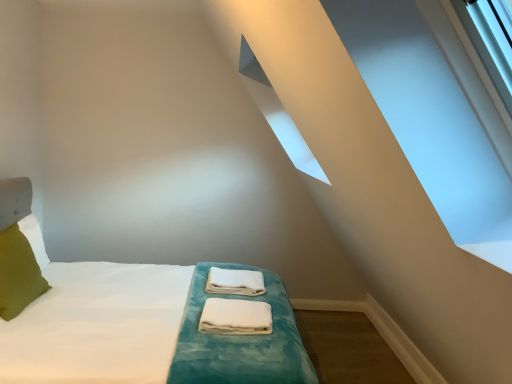
Question: Is green fabric pillow at left wider than white cotton towels at center, marked as the first material in a front-to-back arrangement?

Choices:
 (A) yes
 (B) no

Answer: (B)

Question: Considering the relative sizes of green fabric pillow at left and white cotton towels at center, marked as the first material in a front-to-back arrangement, in the image provided, is green fabric pillow at left bigger than white cotton towels at center, marked as the first material in a front-to-back arrangement,?

Choices:
 (A) no
 (B) yes

Answer: (B)

Question: Is green fabric pillow at left at the left side of white cotton towels at center, marked as the first material in a front-to-back arrangement?

Choices:
 (A) no
 (B) yes

Answer: (B)

Question: Is green fabric pillow at left far from white cotton towels at center, marked as the first material in a front-to-back arrangement?

Choices:
 (A) yes
 (B) no

Answer: (A)

Question: Would you say white cotton towels at center, marked as the first material in a front-to-back arrangement, is part of green fabric pillow at left's contents?

Choices:
 (A) yes
 (B) no

Answer: (B)

Question: Is white cotton towels at center, marked as the first material in a front-to-back arrangement, in front of or behind white soft bed at center in the image?

Choices:
 (A) front
 (B) behind

Answer: (B)

Question: Is white cotton towels at center, marked as the first material in a front-to-back arrangement, taller or shorter than white soft bed at center?

Choices:
 (A) short
 (B) tall

Answer: (A)

Question: In the image, is white cotton towels at center, which is the second material from back to front, on the left side or the right side of white soft bed at center?

Choices:
 (A) left
 (B) right

Answer: (B)

Question: From the image's perspective, is white cotton towels at center, marked as the first material in a front-to-back arrangement, positioned above or below white soft bed at center?

Choices:
 (A) above
 (B) below

Answer: (B)

Question: From their relative heights in the image, would you say white fabric towels at center, marked as the 2th material in a front-to-back arrangement, is taller or shorter than white cotton towels at center, marked as the first material in a front-to-back arrangement?

Choices:
 (A) tall
 (B) short

Answer: (A)

Question: Is white fabric towels at center, which ranks as the 1th material in back-to-front order, to the left or to the right of white cotton towels at center, which is the second material from back to front, in the image?

Choices:
 (A) left
 (B) right

Answer: (A)

Question: In terms of width, does white fabric towels at center, marked as the 2th material in a front-to-back arrangement, look wider or thinner when compared to white cotton towels at center, which is the second material from back to front?

Choices:
 (A) thin
 (B) wide

Answer: (B)

Question: Is white fabric towels at center, marked as the 2th material in a front-to-back arrangement, in front of or behind white cotton towels at center, marked as the first material in a front-to-back arrangement, in the image?

Choices:
 (A) behind
 (B) front

Answer: (A)

Question: Which is correct: white fabric towels at center, which ranks as the 1th material in back-to-front order, is inside green fabric pillow at left, or outside of it?

Choices:
 (A) outside
 (B) inside

Answer: (A)

Question: In the image, is white fabric towels at center, marked as the 2th material in a front-to-back arrangement, on the left side or the right side of green fabric pillow at left?

Choices:
 (A) left
 (B) right

Answer: (B)